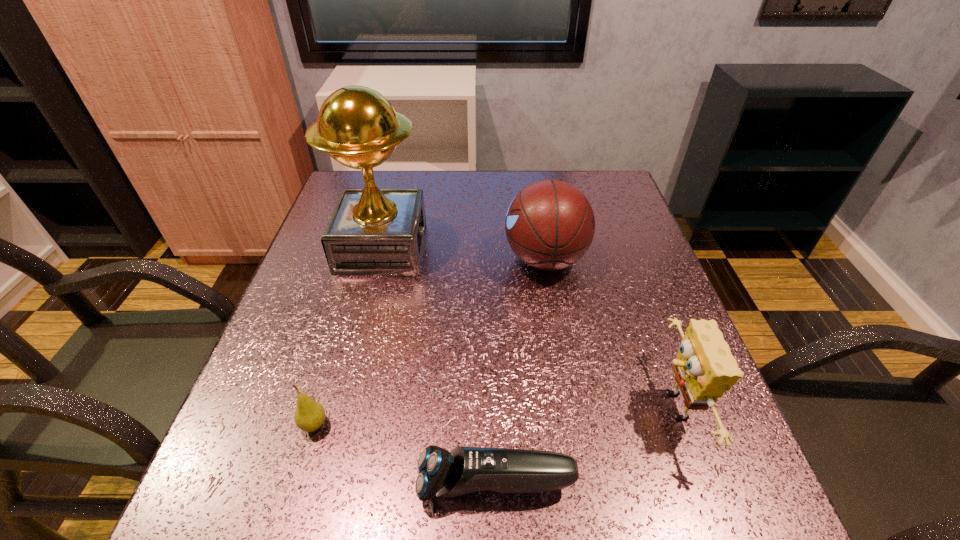
Image resolution: width=960 pixels, height=540 pixels. What are the coordinates of `vacant space that's between the third tallest object and the electric shaver` in the screenshot? It's located at (585, 446).

The width and height of the screenshot is (960, 540). What are the coordinates of `vacant space that's between the second shortest object and the basketball` in the screenshot? It's located at (430, 342).

I want to click on free space between the basketball and the shortest object, so click(x=520, y=372).

Where is `empty space between the award and the third shortest object`? This screenshot has width=960, height=540. empty space between the award and the third shortest object is located at coordinates (527, 327).

Locate an element on the screen. free space between the basketball and the rightmost object is located at coordinates (609, 333).

Locate an element on the screen. The height and width of the screenshot is (540, 960). the third closest object to the basketball is located at coordinates (463, 470).

Identify which object is located as the third nearest to the second shortest object. Please provide its 2D coordinates. Your answer should be formatted as a tuple, i.e. [(x, y)], where the tuple contains the x and y coordinates of a point satisfying the conditions above.

[(550, 224)]

Locate an element on the screen. free location that satisfies the following two spatial constraints: 1. on the front-facing side of the award; 2. on the left side of the basketball is located at coordinates (379, 259).

Where is `free spot that satisfies the following two spatial constraints: 1. on the front-facing side of the tallest object; 2. on the back side of the basketball`? The width and height of the screenshot is (960, 540). free spot that satisfies the following two spatial constraints: 1. on the front-facing side of the tallest object; 2. on the back side of the basketball is located at coordinates (379, 259).

In order to click on free spot that satisfies the following two spatial constraints: 1. on the front side of the basketball; 2. on the head of the shortest object in this screenshot , I will do `click(583, 484)`.